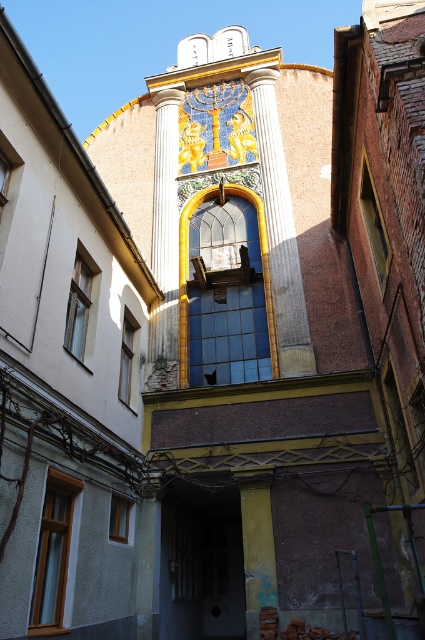
Consider the image. You are an architect examining the building facade. You notice the gold textured column at center and the yellow painted wood at center. Which object is located to the right of the other?

The gold textured column at center is positioned on the left side of yellow painted wood at center, so the yellow painted wood at center is to the right of the gold textured column at center.

You are an architect examining the building facade. You see the white marble column at center and the gold textured column at center. Which column is located to the right of the other?

The white marble column at center is positioned on the right side of gold textured column at center.

You are an architect examining the building facade. You notice the gold textured column at center and the yellow painted wood at center. Based on their positions, which one is closer to the ground?

The yellow painted wood at center is closer to the ground because the gold textured column at center is above it.